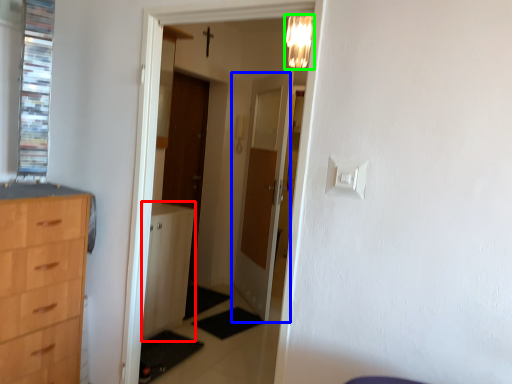
Question: Which object is positioned farthest from file cabinet (highlighted by a red box)? Select from door (highlighted by a blue box) and light fixture (highlighted by a green box).

Choices:
 (A) door
 (B) light fixture

Answer: (B)